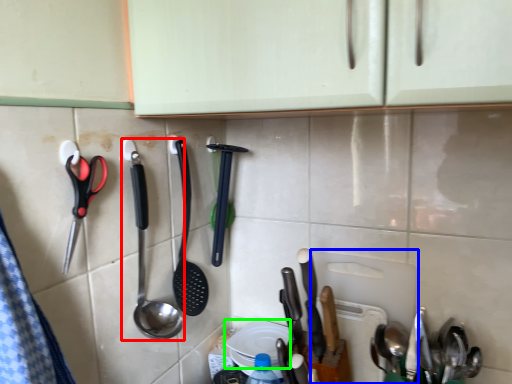
Question: Estimate the real-world distances between objects in this image. Which object is closer to spoon (highlighted by a red box), cutting board (highlighted by a blue box) or plate (highlighted by a green box)?

Choices:
 (A) cutting board
 (B) plate

Answer: (B)